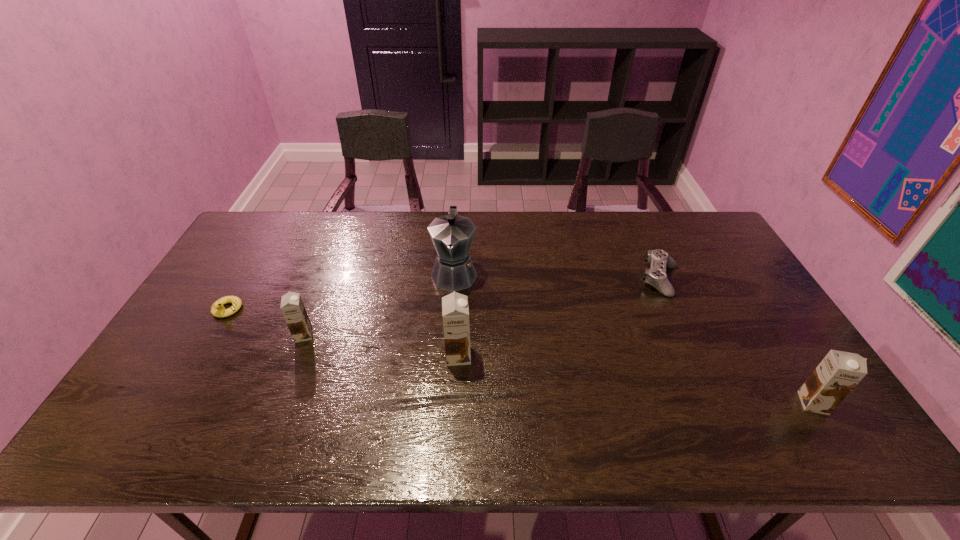
Find the location of a particular element. vacant space at the far edge is located at coordinates (321, 215).

The width and height of the screenshot is (960, 540). Find the location of `free space at the near edge of the desktop`. free space at the near edge of the desktop is located at coordinates (578, 380).

Identify the location of vacant space at the left edge of the desktop. This screenshot has width=960, height=540. 217,272.

In the image, there is a desktop. Find the location of `vacant space at the right edge`. vacant space at the right edge is located at coordinates (702, 269).

Find the location of a particular element. The image size is (960, 540). free space at the far left corner is located at coordinates (290, 226).

Locate an element on the screen. The width and height of the screenshot is (960, 540). free region at the near right corner of the desktop is located at coordinates (778, 380).

Where is `free space between the nearest chocolate milk and the shortest chocolate milk`? This screenshot has height=540, width=960. free space between the nearest chocolate milk and the shortest chocolate milk is located at coordinates (559, 369).

Find the location of `free space that is in between the coffeepot and the control`. free space that is in between the coffeepot and the control is located at coordinates pos(557,276).

Where is `free area in between the rightmost object and the second chocolate milk from left to right`? free area in between the rightmost object and the second chocolate milk from left to right is located at coordinates (636, 380).

You are a GUI agent. You are given a task and a screenshot of the screen. Output one action in this format:
    pyautogui.click(x=<x>, y=<y>)
    Task: Click on the vacant space that is in between the leftmost object and the second object from right to left
    The width and height of the screenshot is (960, 540).
    Given the screenshot: What is the action you would take?
    pyautogui.click(x=444, y=295)